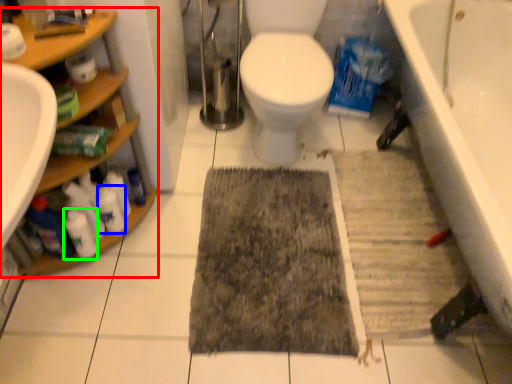
Question: Estimate the real-world distances between objects in this image. Which object is farther from shelf (highlighted by a red box), cleaning product (highlighted by a blue box) or cleaning product (highlighted by a green box)?

Choices:
 (A) cleaning product
 (B) cleaning product

Answer: (B)